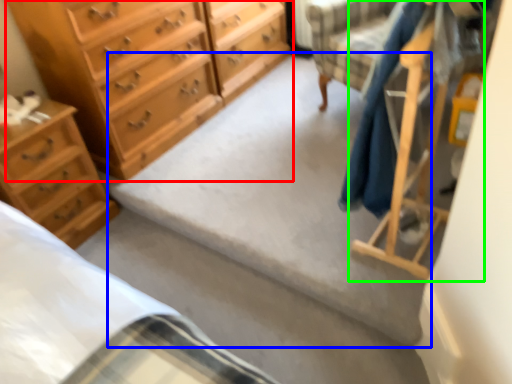
Question: Which is farther away from chest of drawers (highlighted by a red box)? concrete (highlighted by a blue box) or furniture (highlighted by a green box)?

Choices:
 (A) concrete
 (B) furniture

Answer: (B)